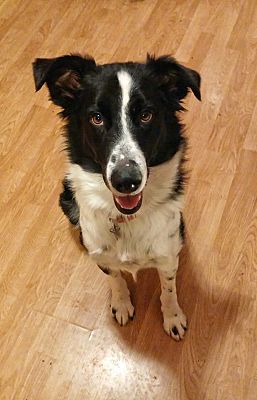
This screenshot has height=400, width=257. Identify the location of floor. (26, 270).